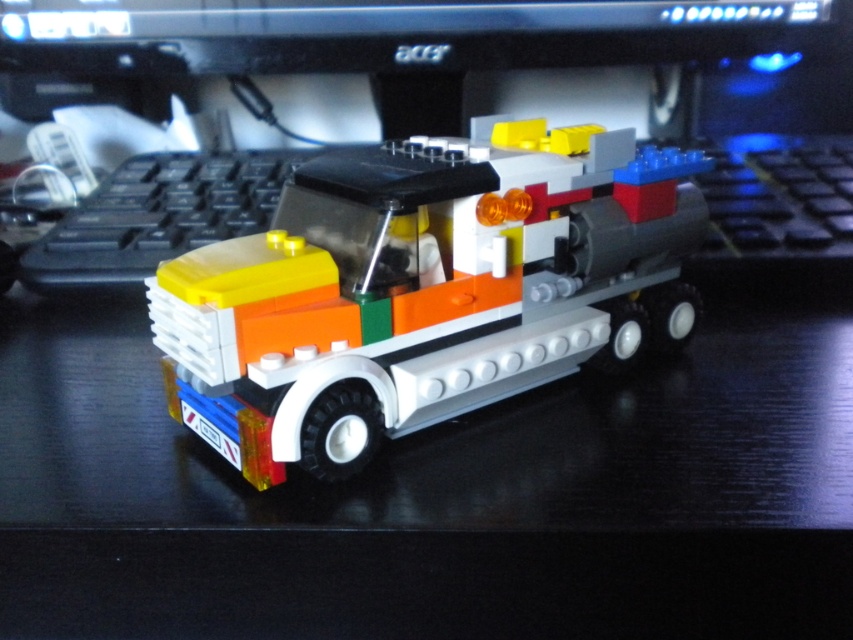
You are trying to place the translucent orange lego truck at center on top of the black plastic computer monitor at upper center. Will the truck fit entirely on the monitor without hanging over the edges?

The translucent orange lego truck at center has a lesser width compared to the black plastic computer monitor at upper center, so the truck will fit entirely on the monitor without hanging over the edges.

Please provide the coordinates of the translucent orange lego truck at center in the image. The coordinate system is defined with the origin at the bottom left corner of the image, where the x and y axes increase to the right and upwards respectively. The coordinates are normalized between 0 and 1. Please answer with the exact values provided in the description.

The translucent orange lego truck at center is located at coordinates point (426, 289).

You are trying to place a small sticker on the LEGO vehicle. The sticker can only be placed on a specific point. Is the point at coordinate (x=426, y=289) on the LEGO vehicle?

Yes, the point at coordinate (x=426, y=289) is on the translucent orange lego truck at center, so the sticker can be placed there.